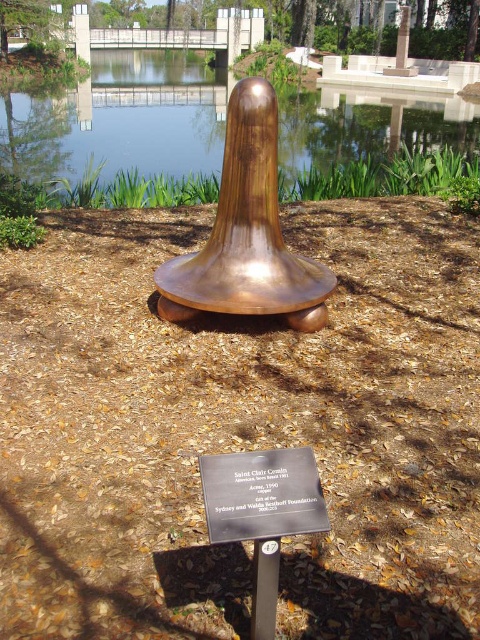
Question: Which point is farther from the camera taking this photo?

Choices:
 (A) (237, 240)
 (B) (283, 518)

Answer: (A)

Question: Considering the real-world distances, which object is farthest from the copper polished sculpture at center?

Choices:
 (A) black metal plaque at center
 (B) transparent glass water at center

Answer: (B)

Question: Does transparent glass water at center have a larger size compared to black metal plaque at center?

Choices:
 (A) no
 (B) yes

Answer: (B)

Question: Which of the following is the closest to the observer?

Choices:
 (A) black metal plaque at center
 (B) copper polished sculpture at center

Answer: (A)

Question: Does transparent glass water at center appear over black metal plaque at center?

Choices:
 (A) no
 (B) yes

Answer: (B)

Question: Can you confirm if copper polished sculpture at center is bigger than black metal plaque at center?

Choices:
 (A) yes
 (B) no

Answer: (A)